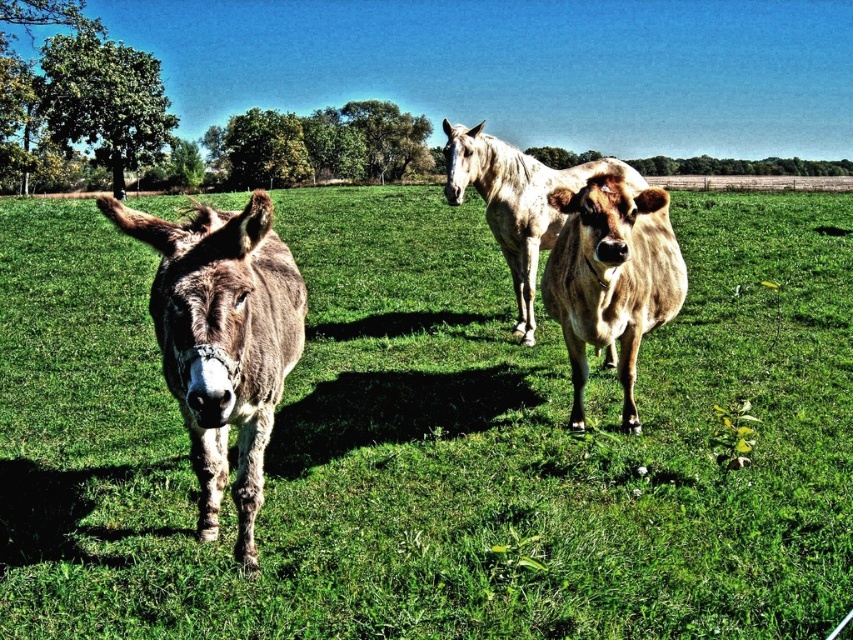
Question: Does brown smooth cow at center have a greater width compared to speckled white horse at center?

Choices:
 (A) no
 (B) yes

Answer: (A)

Question: Which of the following is the farthest from the observer?

Choices:
 (A) speckled white horse at center
 (B) green grass at center

Answer: (A)

Question: Can you confirm if green grass at center is positioned to the right of speckled white horse at center?

Choices:
 (A) yes
 (B) no

Answer: (A)

Question: Which point appears farthest from the camera in this image?

Choices:
 (A) (550, 256)
 (B) (518, 172)
 (C) (722, 353)

Answer: (B)

Question: Which point is farther to the camera?

Choices:
 (A) speckled white horse at center
 (B) green grass at center
 (C) brown smooth cow at center
 (D) brown textured mule at left

Answer: (A)

Question: Is green grass at center wider than brown smooth cow at center?

Choices:
 (A) yes
 (B) no

Answer: (A)